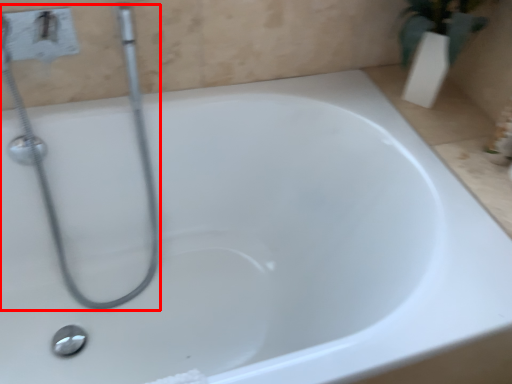
Question: From the image, what is the correct spatial relationship of plumbing fixture (annotated by the red box) in relation to shower?

Choices:
 (A) left
 (B) right

Answer: (B)